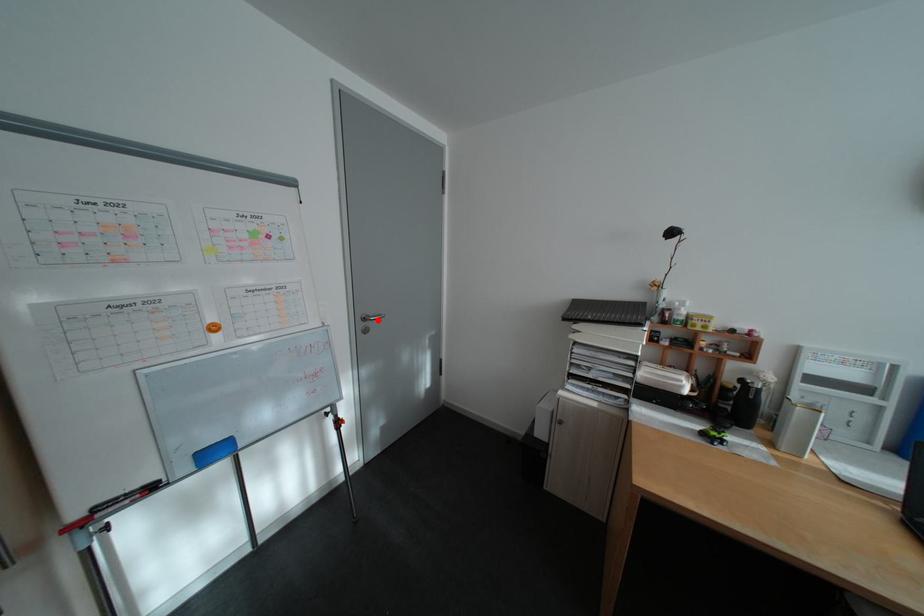
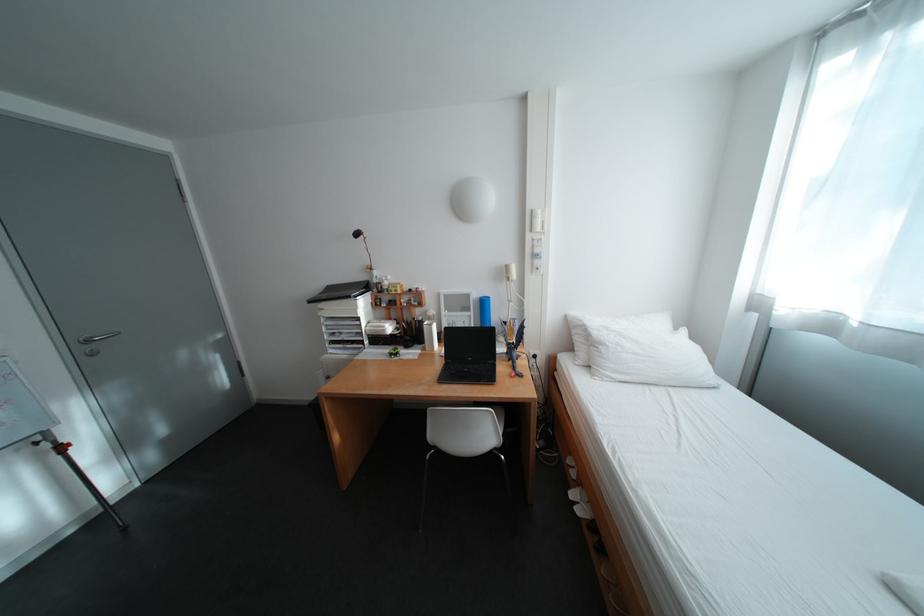
Locate, in the second image, the point that corresponds to the highlighted location in the first image.

(100, 342)